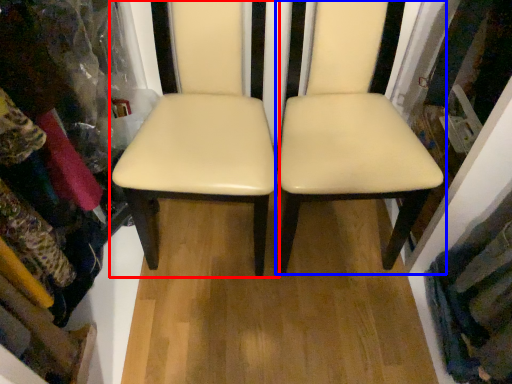
Question: Which point is closer to the camera, chair (highlighted by a red box) or chair (highlighted by a blue box)?

Choices:
 (A) chair
 (B) chair

Answer: (B)